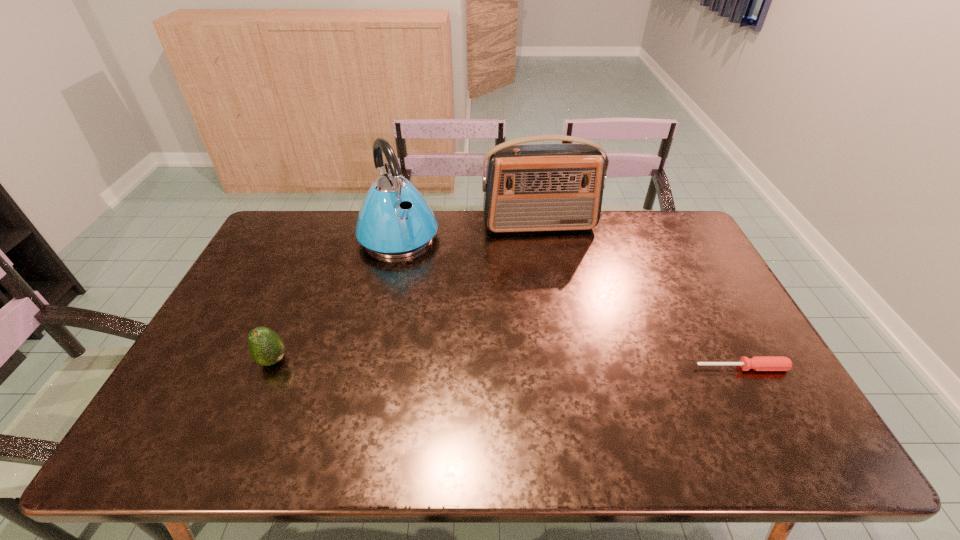
This screenshot has height=540, width=960. I want to click on the leftmost object, so click(266, 347).

Locate an element on the screen. The image size is (960, 540). avocado is located at coordinates (266, 347).

Where is `screwdriver`? The width and height of the screenshot is (960, 540). screwdriver is located at coordinates (758, 363).

Where is `the rightmost object`? the rightmost object is located at coordinates (758, 363).

Locate an element on the screen. This screenshot has width=960, height=540. radio receiver is located at coordinates (534, 187).

Where is `kettle`? This screenshot has width=960, height=540. kettle is located at coordinates (395, 221).

Where is `blank space located on the right of the avocado`? blank space located on the right of the avocado is located at coordinates (410, 361).

Where is `vacant space located at the tip of the rightmost object`? The width and height of the screenshot is (960, 540). vacant space located at the tip of the rightmost object is located at coordinates (754, 389).

You are a GUI agent. You are given a task and a screenshot of the screen. Output one action in this format:
    pyautogui.click(x=<x>, y=<y>)
    Task: Click on the free space located 0.060m on the front-facing side of the radio receiver
    
    Given the screenshot: What is the action you would take?
    pyautogui.click(x=547, y=247)

At what (x,y) coordinates should I click in order to perform the action: click on free space located 0.340m on the front-facing side of the radio receiver. Please return your answer as a coordinate pair (x, y). This screenshot has width=960, height=540. Looking at the image, I should click on (563, 306).